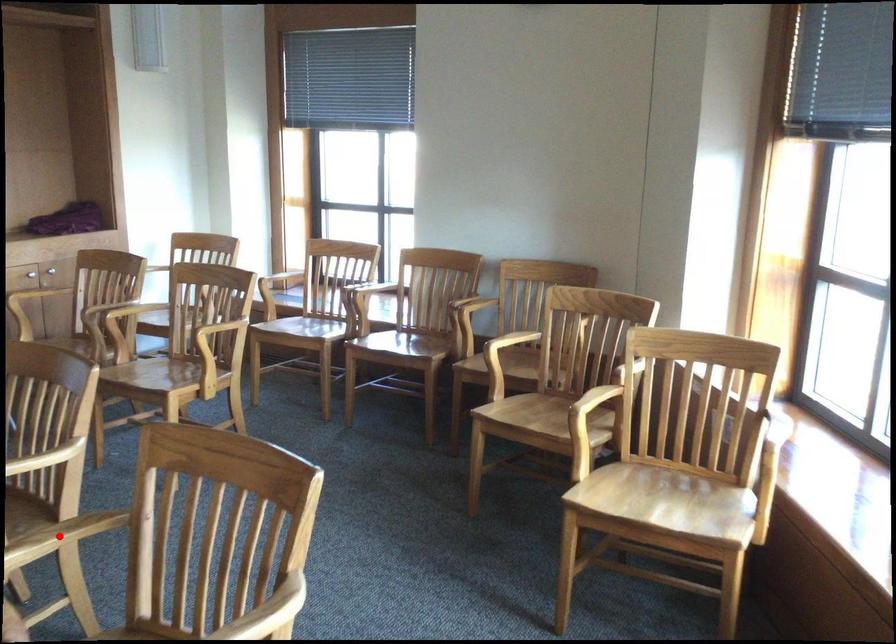
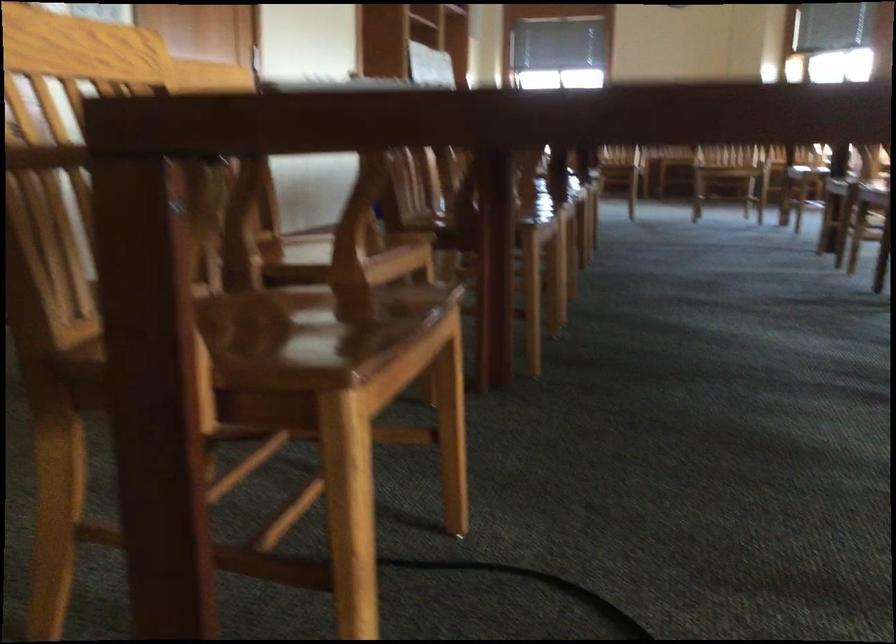
Question: I am providing you with two images of the same scene from different viewpoints. A red point is marked on the first image. Can you still see the location of the red point in image 2?

Choices:
 (A) Yes
 (B) No

Answer: (B)